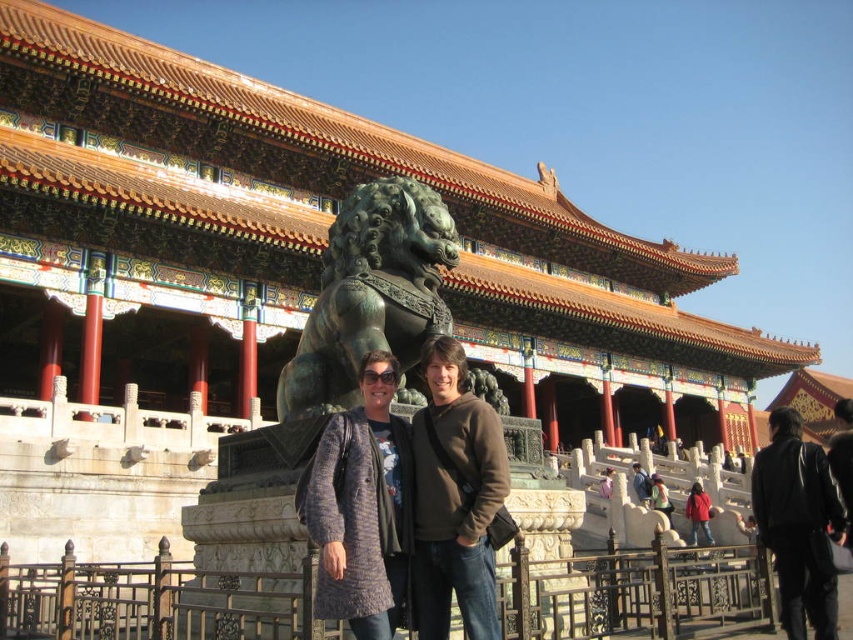
You are a tourist visiting the Forbidden City and notice two leather jackets in the scene. The black leather jacket at lower right and the brown leather jacket at center. Which jacket is taller?

The black leather jacket at lower right is taller than the brown leather jacket at center.

You are visiting the Forbidden City and notice two jackets. The black leather jacket at lower right and the brown leather jacket at center. Which jacket is positioned higher in the scene?

The black leather jacket at lower right is located above the brown leather jacket at center, so it is positioned higher in the scene.

You are standing at the entrance of the Forbidden City and see a large bronze lion statue in the foreground. There is also a point marked at coordinates (454,499). What object is located at that point?

The object at point (454,499) is the matte gray sweater at center.